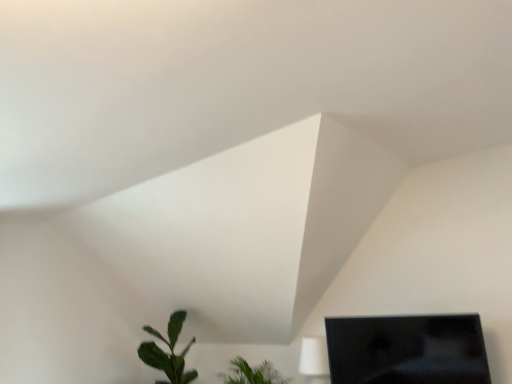
Question: Visually, is green matte leafy plant at lower left, which is counted as the first houseplant, starting from the left, positioned to the left or to the right of green leafy plant at lower center, acting as the second houseplant starting from the left?

Choices:
 (A) right
 (B) left

Answer: (B)

Question: Considering the positions of point (157, 365) and point (281, 375), is point (157, 365) closer or farther from the camera than point (281, 375)?

Choices:
 (A) closer
 (B) farther

Answer: (B)

Question: Which object is positioned closest to the green matte leafy plant at lower left, which is counted as the first houseplant, starting from the left?

Choices:
 (A) green leafy plant at lower center, acting as the second houseplant starting from the left
 (B) black glossy monitor at lower right

Answer: (A)

Question: Based on their relative distances, which object is farther from the black glossy monitor at lower right?

Choices:
 (A) green matte leafy plant at lower left, which is counted as the first houseplant, starting from the left
 (B) green leafy plant at lower center, acting as the second houseplant starting from the left

Answer: (A)